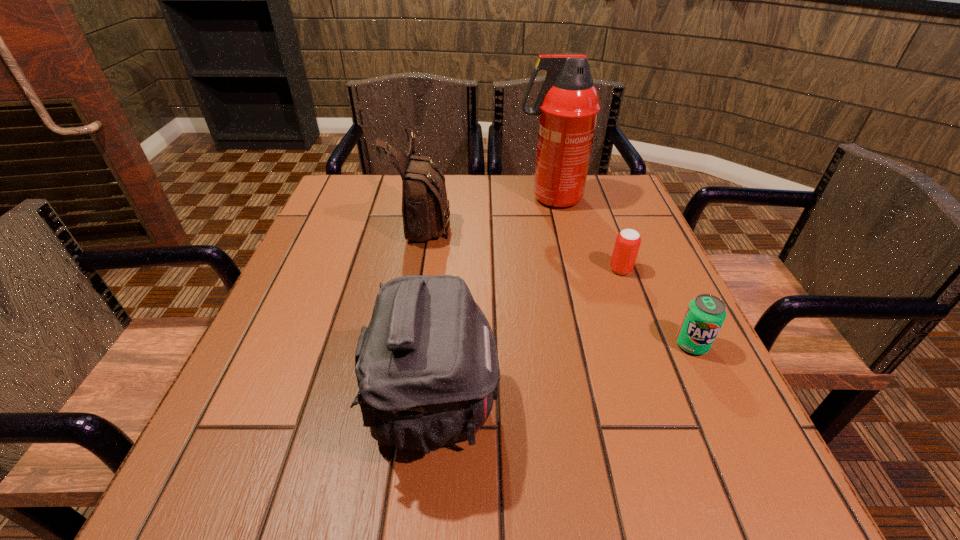
You are a GUI agent. You are given a task and a screenshot of the screen. Output one action in this format:
    pyautogui.click(x=<x>, y=<y>)
    Task: Click on the object positioned at the far right corner
    
    Given the screenshot: What is the action you would take?
    pyautogui.click(x=568, y=104)

The height and width of the screenshot is (540, 960). In the image, there is a desktop. Find the location of `vacant space at the far edge`. vacant space at the far edge is located at coordinates (558, 215).

The width and height of the screenshot is (960, 540). In the image, there is a desktop. Find the location of `free space at the near edge`. free space at the near edge is located at coordinates click(487, 484).

Where is `vacant space at the left edge of the desktop`? vacant space at the left edge of the desktop is located at coordinates 343,224.

What are the coordinates of `vacant region at the right edge` in the screenshot? It's located at (682, 355).

This screenshot has width=960, height=540. I want to click on vacant point at the far left corner, so click(x=367, y=193).

Find the location of a particular element. vacant space at the far right corner of the desktop is located at coordinates (624, 213).

Where is `vacant region at the near right corner of the desktop`? This screenshot has height=540, width=960. vacant region at the near right corner of the desktop is located at coordinates (778, 487).

This screenshot has width=960, height=540. In order to click on vacant region between the pop soda and the nearer shoulder bag in this screenshot , I will do `click(564, 376)`.

Image resolution: width=960 pixels, height=540 pixels. I want to click on free space between the nearer shoulder bag and the fire extinguisher, so click(x=492, y=302).